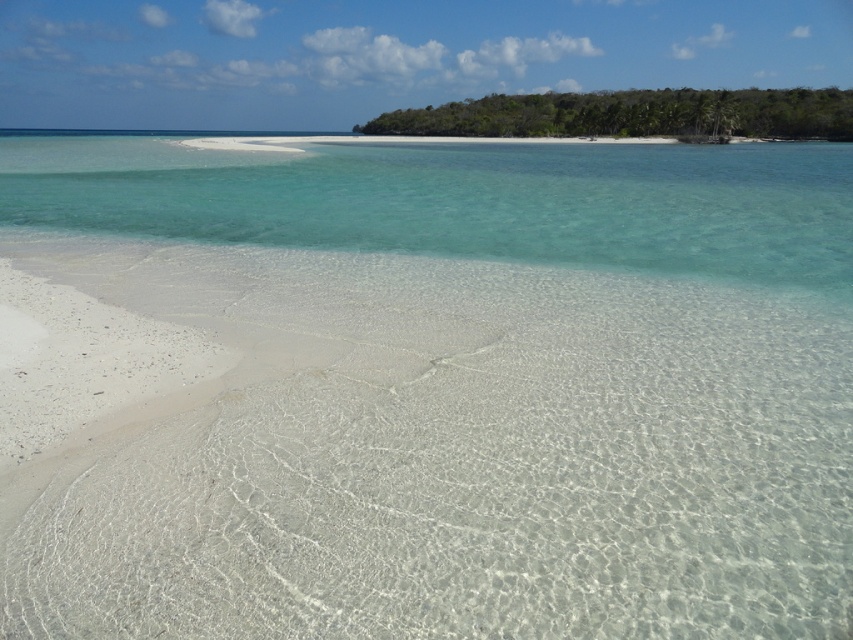
You are standing on the beach and want to take a photo that includes both the clear water at center and the green leafy island at upper right. Based on their positions, which object should you adjust your camera to focus on first to ensure both are in the frame?

The clear water at center is positioned on the left side of green leafy island at upper right, so you should focus on the green leafy island at upper right first to ensure both are in the frame.

Looking at this image, you are standing on the beach looking out at the water. There are two points marked on the sand. The first point is at coordinates point (x=440, y=202) and the second point is at point (x=419, y=109). Which of these two points is closer to you?

Point (x=440, y=202) is closer to the viewer than point (x=419, y=109).

You are planning to build a small sandcastle on the beach. You need to know which area is wider between the white sand at lower left and the green leafy island at upper right. Which one is wider?

The white sand at lower left is less than the green leafy island at upper right in width, so the green leafy island at upper right is wider.